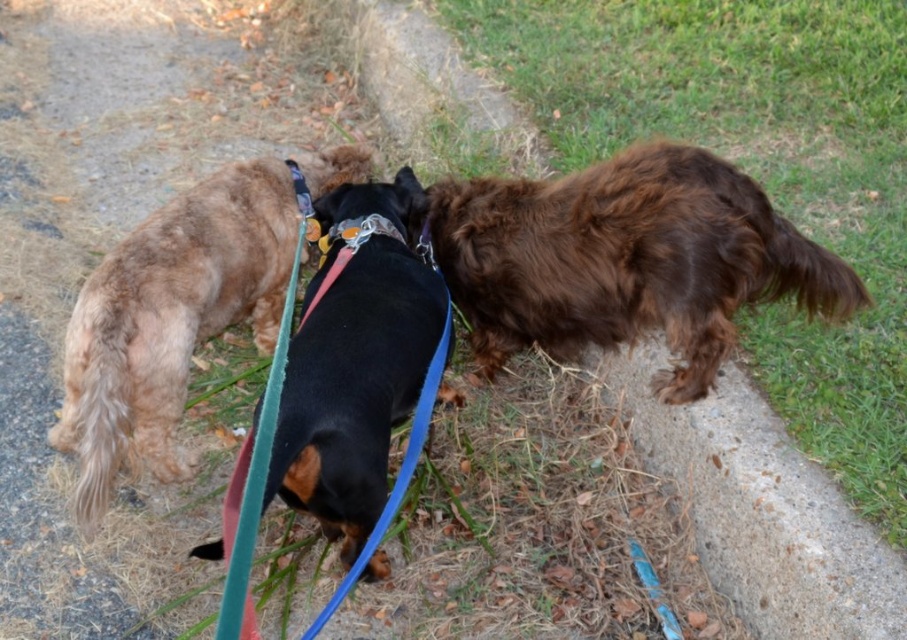
Question: Does brown furry dog at right have a smaller size compared to light brown fur at left?

Choices:
 (A) no
 (B) yes

Answer: (A)

Question: Is brown furry dog at right to the left of shiny brown fur at center from the viewer's perspective?

Choices:
 (A) no
 (B) yes

Answer: (A)

Question: Estimate the real-world distances between objects in this image. Which object is closer to the metallic silver neckband at center?

Choices:
 (A) shaggy brown dog at right
 (B) brown furry dog at right
 (C) light brown fur at left
 (D) shiny brown fur at center

Answer: (D)

Question: Which is nearer to the brown furry dog at right?

Choices:
 (A) light brown fur at left
 (B) shaggy brown dog at right

Answer: (B)

Question: Estimate the real-world distances between objects in this image. Which object is closer to the shiny brown fur at center?

Choices:
 (A) shaggy brown dog at right
 (B) light brown fur at left
 (C) metallic silver neckband at center

Answer: (C)

Question: Can you confirm if shaggy brown dog at right is thinner than shiny brown fur at center?

Choices:
 (A) no
 (B) yes

Answer: (A)